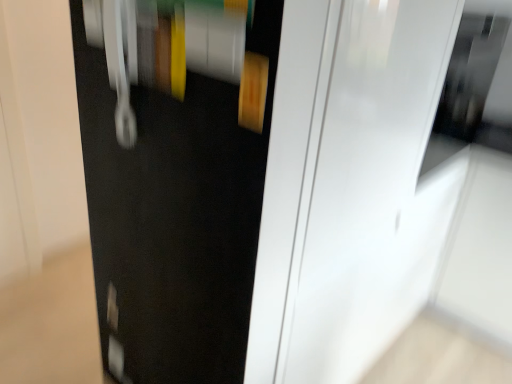
What is the approximate height of white glossy screen door at center?

It is 5.04 feet.

The image size is (512, 384). What do you see at coordinates (366, 188) in the screenshot?
I see `white glossy screen door at center` at bounding box center [366, 188].

In order to click on white glossy screen door at center in this screenshot , I will do `click(366, 188)`.

Measure the distance between white glossy screen door at center and camera.

78.58 centimeters.

You are a GUI agent. You are given a task and a screenshot of the screen. Output one action in this format:
    pyautogui.click(x=<x>, y=<y>)
    Task: Click on the white glossy screen door at center
    This screenshot has height=384, width=512.
    Given the screenshot: What is the action you would take?
    pyautogui.click(x=366, y=188)